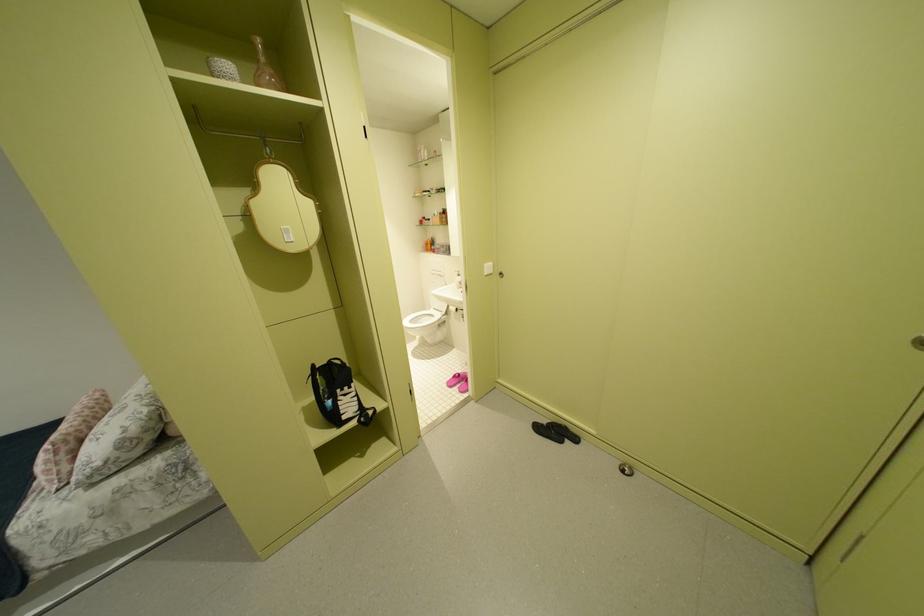
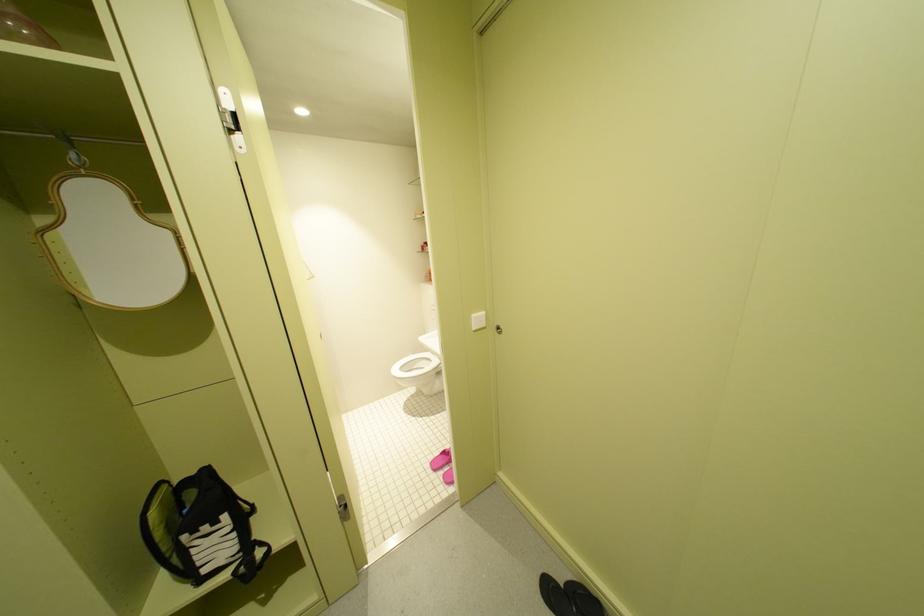
From the picture: In a continuous first-person perspective shot, in which direction is the camera moving?

The movement direction of the cameraman is right, forward.